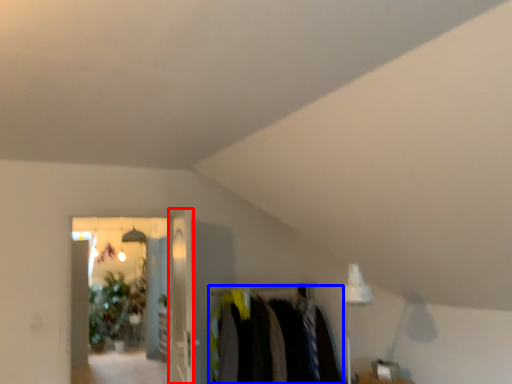
Question: Which object appears farthest to the camera in this image, glass door (highlighted by a red box) or closet (highlighted by a blue box)?

Choices:
 (A) glass door
 (B) closet

Answer: (B)